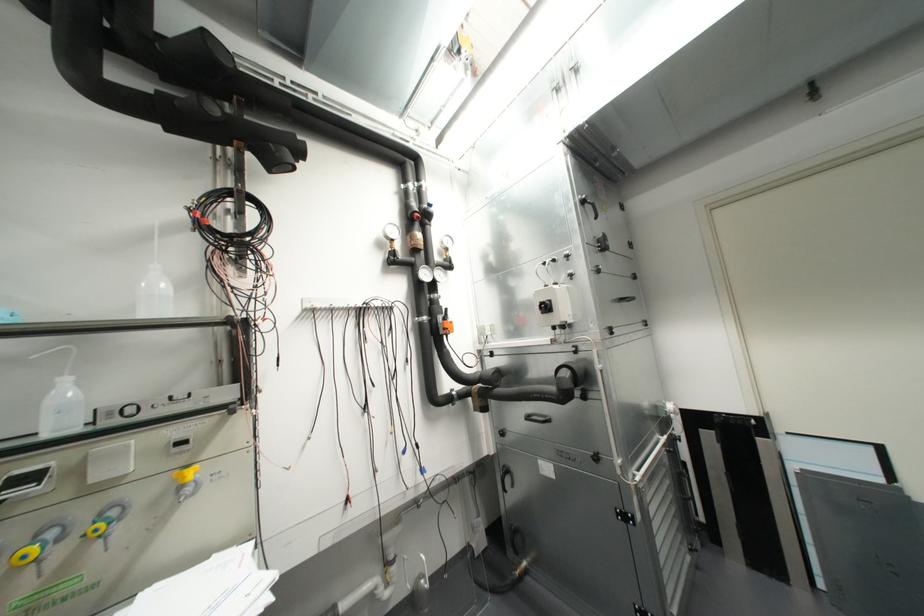
Where would you pull the black panel handle? Please return your answer as a coordinate pair (x, y).

(537, 418)